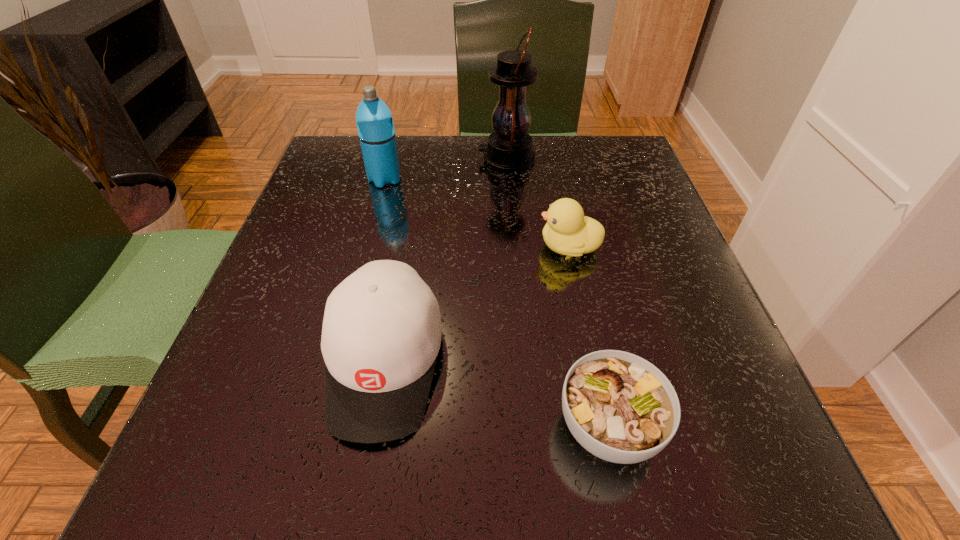
Locate an element on the screen. Image resolution: width=960 pixels, height=540 pixels. vacant space at the far right corner is located at coordinates (639, 179).

At what (x,y) coordinates should I click in order to perform the action: click on free spot between the soup bowl and the lantern. Please return your answer as a coordinate pair (x, y). The width and height of the screenshot is (960, 540). Looking at the image, I should click on (558, 293).

You are a GUI agent. You are given a task and a screenshot of the screen. Output one action in this format:
    pyautogui.click(x=<x>, y=<y>)
    Task: Click on the unoccupied area between the tallest object and the fourth shortest object
    The height and width of the screenshot is (540, 960).
    Given the screenshot: What is the action you would take?
    pyautogui.click(x=445, y=169)

Where is `vacant space that is in between the third nearest object and the thermos bottle`? vacant space that is in between the third nearest object and the thermos bottle is located at coordinates (477, 213).

Find the location of `empty location between the second tallest object and the duckling`. empty location between the second tallest object and the duckling is located at coordinates (477, 213).

Where is `vacant point located between the tallest object and the baseball cap`? vacant point located between the tallest object and the baseball cap is located at coordinates (445, 260).

Locate an element on the screen. This screenshot has height=540, width=960. vacant area that lies between the soup bowl and the baseball cap is located at coordinates (496, 394).

Find the location of a particular element. unoccupied position between the soup bowl and the lantern is located at coordinates (558, 293).

Find the location of a particular element. free point between the second shortest object and the shortest object is located at coordinates (588, 337).

In order to click on vacant point located between the soup bowl and the baseball cap in this screenshot , I will do `click(496, 394)`.